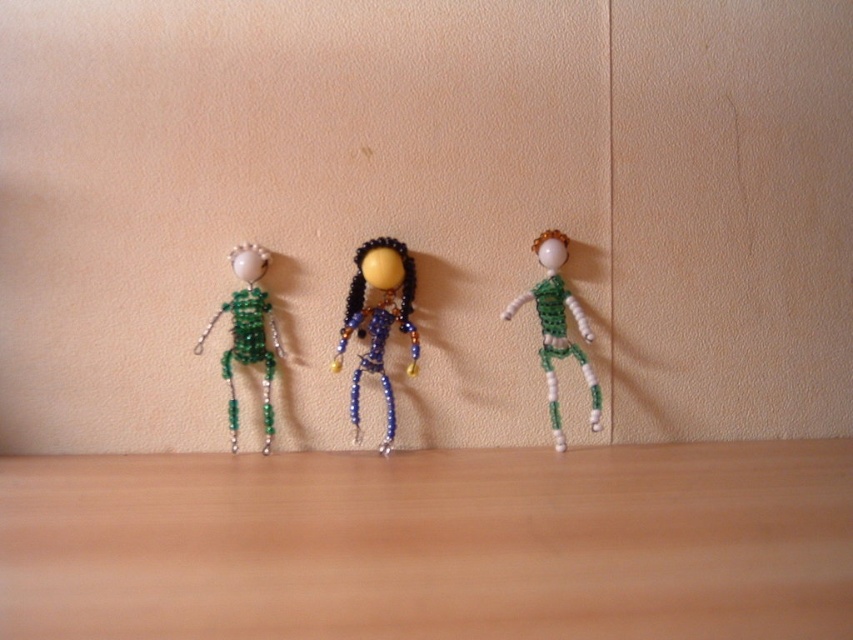
You are an artist observing the three dolls on the wooden surface. You need to place a new decorative item between the blue beaded doll at center and the green beaded figure at right. Based on their positions, where should you place the item to ensure it is between them?

The blue beaded doll at center is located below the green beaded figure at right, so placing the decorative item above the blue beaded doll at center and below the green beaded figure at right would position it between them.

You are a small toy car that is 10 cm tall. You are currently on the wooden table at lower center and want to move to the green beaded figure at right. Can you drive directly to it without any obstacles?

The wooden table at lower center is positioned under green beaded figure at right, so yes, the toy car can drive directly to the green beaded figure at right since there are no mentioned obstacles between them.